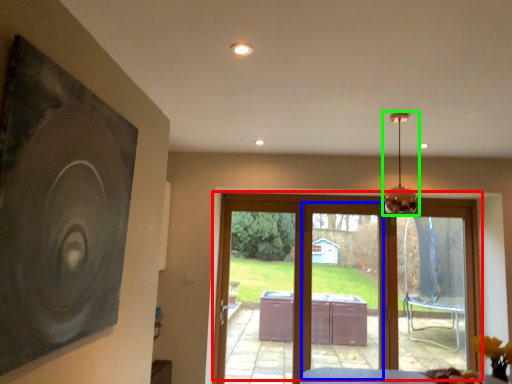
Question: Estimate the real-world distances between objects in this image. Which object is farther from door (highlighted by a red box), screen door (highlighted by a blue box) or lamp (highlighted by a green box)?

Choices:
 (A) screen door
 (B) lamp

Answer: (B)